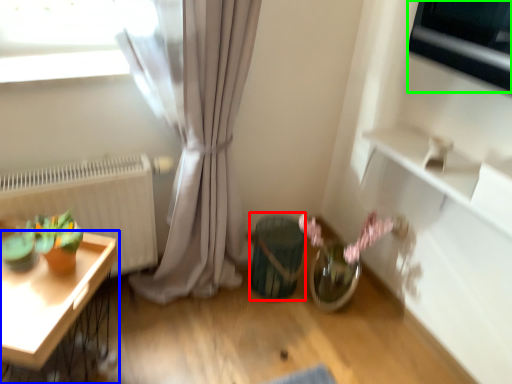
Question: Which object is the closest to the vase (highlighted by a red box)? Choose among these: table (highlighted by a blue box) or appliance (highlighted by a green box).

Choices:
 (A) table
 (B) appliance

Answer: (A)